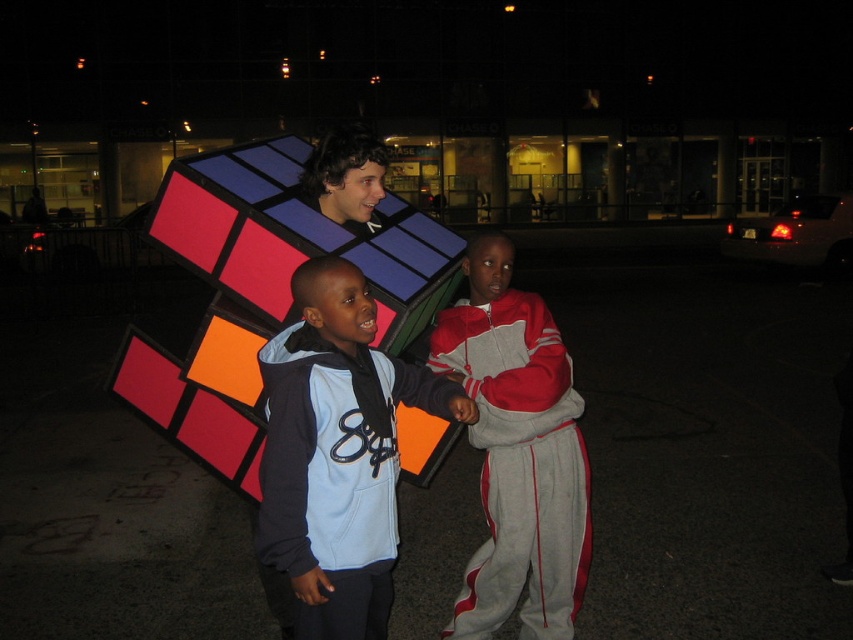
Question: Among these points, which one is nearest to the camera?

Choices:
 (A) (352, 140)
 (B) (503, 600)
 (C) (328, 442)

Answer: (C)

Question: Is light blue fleece jacket at center bigger than shiny plastic rubik's cube at center?

Choices:
 (A) yes
 (B) no

Answer: (A)

Question: Which object is farther from the camera taking this photo?

Choices:
 (A) gray fleece tracksuit at center
 (B) shiny plastic rubik's cube at center
 (C) light blue fleece jacket at center

Answer: (B)

Question: Does light blue fleece jacket at center have a lesser width compared to shiny plastic rubik's cube at center?

Choices:
 (A) yes
 (B) no

Answer: (B)

Question: Considering the real-world distances, which object is farthest from the light blue fleece jacket at center?

Choices:
 (A) gray fleece tracksuit at center
 (B) shiny plastic rubik's cube at center

Answer: (B)

Question: Can you confirm if gray fleece tracksuit at center is positioned below shiny plastic rubik's cube at center?

Choices:
 (A) yes
 (B) no

Answer: (A)